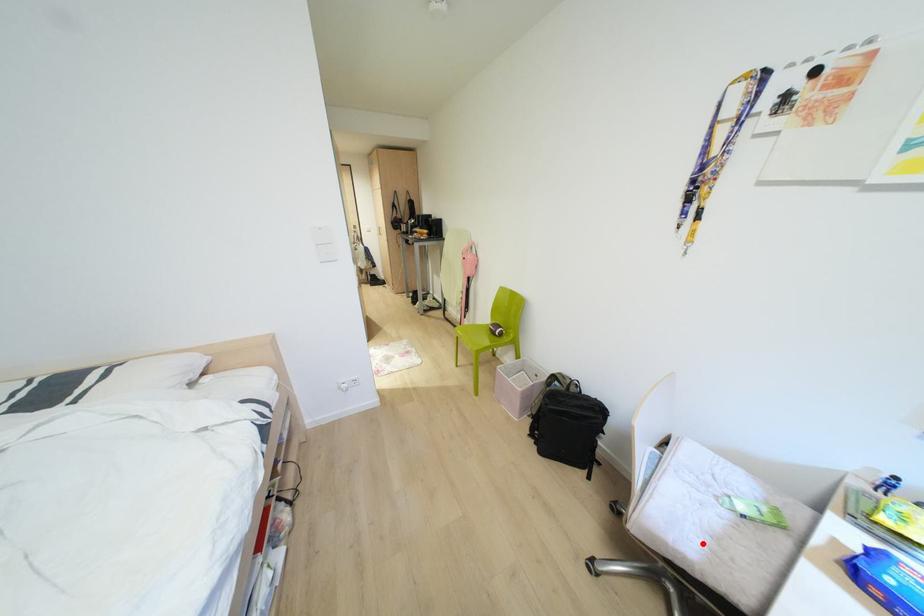
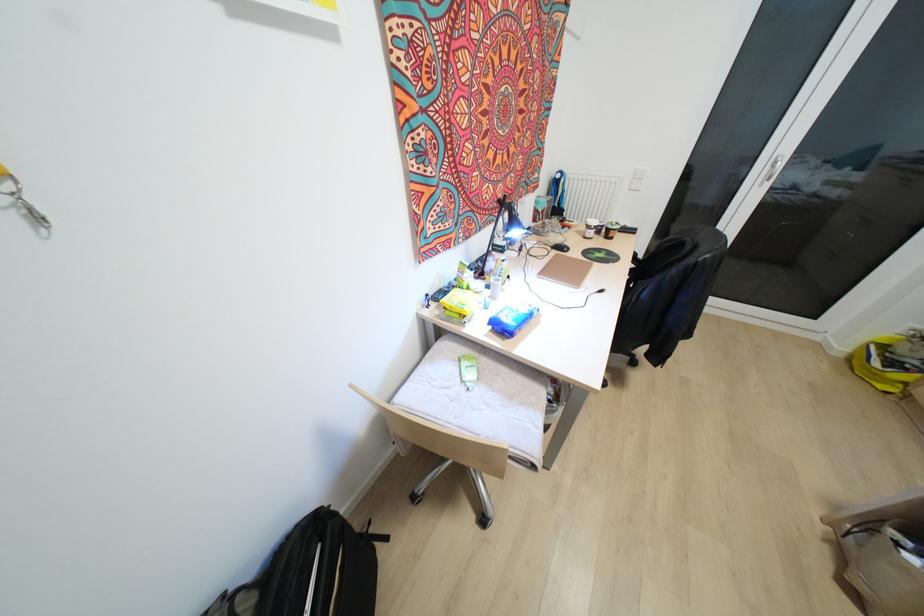
The point at the highlighted location is marked in the first image. Where is the corresponding point in the second image?

(519, 408)